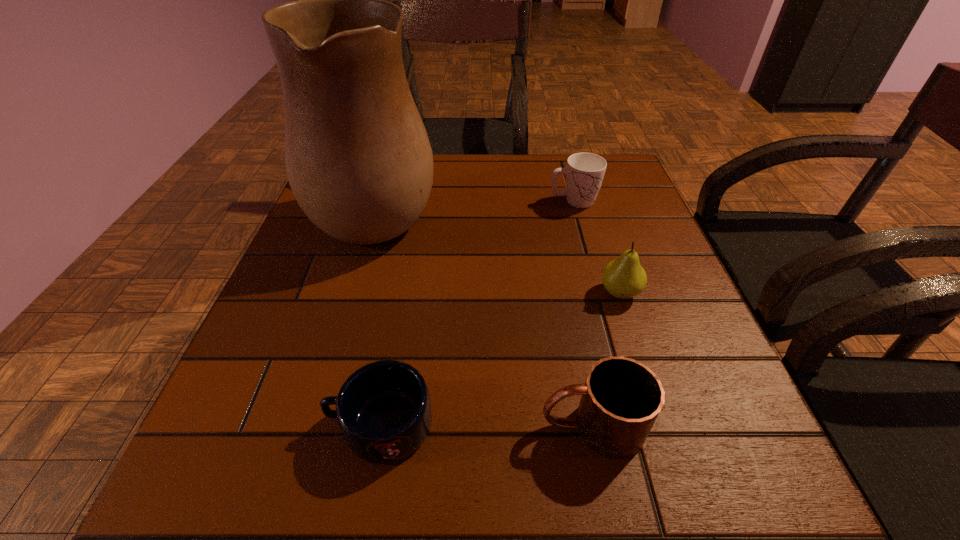
You are a GUI agent. You are given a task and a screenshot of the screen. Output one action in this format:
    pyautogui.click(x=<x>, y=<y>)
    Task: Click on the blank space at the left edge of the desktop
    This screenshot has height=540, width=960.
    Given the screenshot: What is the action you would take?
    pyautogui.click(x=242, y=368)

Locate an element on the screen. The image size is (960, 540). free space at the far right corner of the desktop is located at coordinates (608, 160).

You are a GUI agent. You are given a task and a screenshot of the screen. Output one action in this format:
    pyautogui.click(x=<x>, y=<y>)
    Task: Click on the vacant area that lies between the leftmost mug and the third farthest object
    This screenshot has height=540, width=960.
    Given the screenshot: What is the action you would take?
    pyautogui.click(x=500, y=359)

Identify the location of empty space that is in between the farthest mug and the third farthest object. This screenshot has height=540, width=960. (597, 247).

Where is `vacant area that lies between the leftmost mug and the tallest object`? This screenshot has height=540, width=960. vacant area that lies between the leftmost mug and the tallest object is located at coordinates (379, 316).

Where is `empty space that is in between the farthest mug and the third nearest object`? empty space that is in between the farthest mug and the third nearest object is located at coordinates (597, 247).

Identify the location of empty space that is in between the cream pitcher and the leftmost mug. This screenshot has height=540, width=960. (379, 316).

Identify the location of vacant space in between the third farthest object and the cream pitcher. [498, 251].

Locate an element on the screen. This screenshot has height=540, width=960. the fourth closest object to the shortest object is located at coordinates (584, 172).

Choose which object is the fourth nearest neighbor to the farthest mug. Please provide its 2D coordinates. Your answer should be formatted as a tuple, i.e. [(x, y)], where the tuple contains the x and y coordinates of a point satisfying the conditions above.

[(383, 409)]